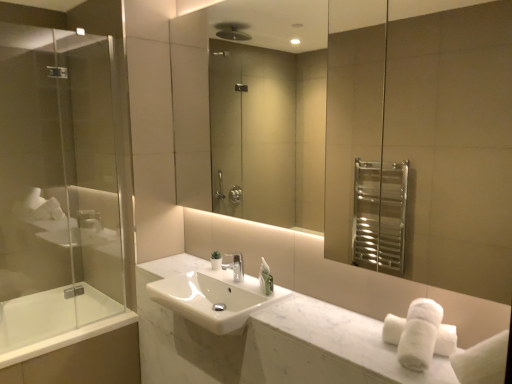
What is the approximate width of white marble counter at center?

13.60 inches.

The image size is (512, 384). What are the coordinates of `white marble counter at center` in the screenshot? It's located at (268, 342).

Measure the distance between white glossy sink at center and camera.

The depth of white glossy sink at center is 1.71 meters.

What do you see at coordinates (54, 322) in the screenshot? I see `white glossy bathtub at lower left` at bounding box center [54, 322].

Locate an element on the screen. The image size is (512, 384). white marble counter at center is located at coordinates (268, 342).

Considering the relative positions of transparent glass screen door at left and white marble counter at center in the image provided, is transparent glass screen door at left to the right of white marble counter at center from the viewer's perspective?

Incorrect, transparent glass screen door at left is not on the right side of white marble counter at center.

Image resolution: width=512 pixels, height=384 pixels. Identify the location of counter in front of the transparent glass screen door at left. (268, 342).

Based on their sizes in the image, would you say transparent glass screen door at left is bigger or smaller than white marble counter at center?

Considering their sizes, transparent glass screen door at left takes up more space than white marble counter at center.

How different are the orientations of transparent glass screen door at left and white marble counter at center in degrees?

The angle between the facing direction of transparent glass screen door at left and the facing direction of white marble counter at center is 90.8 degrees.

Is silver metallic faucet at center situated inside transparent glass screen door at left or outside?

silver metallic faucet at center lies outside transparent glass screen door at left.

Is silver metallic faucet at center touching transparent glass screen door at left?

No, silver metallic faucet at center is not in contact with transparent glass screen door at left.

Is silver metallic faucet at center turned away from transparent glass screen door at left?

No, silver metallic faucet at center is not facing the opposite direction of transparent glass screen door at left.

Is silver metallic faucet at center located within transparent glass screen door at left?

No, silver metallic faucet at center is located outside of transparent glass screen door at left.

How distant is transparent glass screen door at left from silver metallic faucet at center?

transparent glass screen door at left is 1.23 meters from silver metallic faucet at center.

Does point (51, 240) come in front of point (242, 262)?

No, (51, 240) is behind (242, 262).

From the image's perspective, which object appears higher, transparent glass screen door at left or silver metallic faucet at center?

transparent glass screen door at left is shown above in the image.

Is white glossy bathtub at lower left in front of or behind white glossy sink at center in the image?

In the image, white glossy bathtub at lower left appears behind white glossy sink at center.

From the image's perspective, is white glossy bathtub at lower left on top of white glossy sink at center?

No, from the image's perspective, white glossy bathtub at lower left is not above white glossy sink at center.

Does white glossy bathtub at lower left have a smaller size compared to white glossy sink at center?

No.

Could you tell me if white glossy bathtub at lower left is turned towards transparent glass screen door at left?

No, white glossy bathtub at lower left is not aimed at transparent glass screen door at left.

From a real-world perspective, which is physically above, white glossy bathtub at lower left or transparent glass screen door at left?

transparent glass screen door at left is physically above.

Is white glossy bathtub at lower left surrounding transparent glass screen door at left?

No, transparent glass screen door at left is not inside white glossy bathtub at lower left.

From the image's perspective, does white glossy bathtub at lower left appear lower than transparent glass screen door at left?

Yes, from the image's perspective, white glossy bathtub at lower left is below transparent glass screen door at left.

Considering the sizes of white glossy sink at center and silver metallic faucet at center in the image, is white glossy sink at center wider or thinner than silver metallic faucet at center?

In the image, white glossy sink at center appears to be wider than silver metallic faucet at center.

Is white glossy sink at center beside silver metallic faucet at center?

No, white glossy sink at center is not making contact with silver metallic faucet at center.

Between white glossy sink at center and silver metallic faucet at center, which one has larger size?

Bigger between the two is white glossy sink at center.

Could you tell me if white marble counter at center is facing transparent glass screen door at left?

No, white marble counter at center is not facing towards transparent glass screen door at left.

Considering the sizes of objects white marble counter at center and transparent glass screen door at left in the image provided, who is wider, white marble counter at center or transparent glass screen door at left?

Wider between the two is white marble counter at center.

In the scene shown: What's the angular difference between white marble counter at center and transparent glass screen door at left's facing directions?

The angular difference between white marble counter at center and transparent glass screen door at left is 90.8 degrees.

Where is `counter located below the transparent glass screen door at left (from the image's perspective)`? This screenshot has width=512, height=384. counter located below the transparent glass screen door at left (from the image's perspective) is located at coordinates click(x=268, y=342).

Locate an element on the screen. This screenshot has height=384, width=512. screen door that appears in front of the silver metallic faucet at center is located at coordinates (58, 163).

Considering their positions, is silver metallic faucet at center positioned closer to white glossy bathtub at lower left than white marble counter at center?

white marble counter at center is closer to white glossy bathtub at lower left.

Based on their spatial positions, is silver metallic faucet at center or white glossy bathtub at lower left further from white marble counter at center?

The object further to white marble counter at center is white glossy bathtub at lower left.

Estimate the real-world distances between objects in this image. Which object is further from white marble counter at center, white glossy bathtub at lower left or transparent glass screen door at left?

Among the two, transparent glass screen door at left is located further to white marble counter at center.

Based on their spatial positions, is transparent glass screen door at left or silver metallic faucet at center closer to white marble counter at center?

Among the two, silver metallic faucet at center is located nearer to white marble counter at center.

Looking at the image, which one is located closer to white glossy bathtub at lower left, white glossy sink at center or silver metallic faucet at center?

Based on the image, white glossy sink at center appears to be nearer to white glossy bathtub at lower left.

Looking at the image, which one is located closer to white marble counter at center, silver metallic faucet at center or transparent glass screen door at left?

silver metallic faucet at center.

Looking at this image, looking at the image, which one is located closer to white marble counter at center, white glossy sink at center or silver metallic faucet at center?

white glossy sink at center lies closer to white marble counter at center than the other object.

When comparing their distances from silver metallic faucet at center, does white marble counter at center or transparent glass screen door at left seem further?

Among the two, transparent glass screen door at left is located further to silver metallic faucet at center.

Locate an element on the screen. sink between white marble counter at center and silver metallic faucet at center from front to back is located at coordinates (207, 293).

You are a GUI agent. You are given a task and a screenshot of the screen. Output one action in this format:
    pyautogui.click(x=<x>, y=<y>)
    Task: Click on the sink between white glossy bathtub at lower left and white marble counter at center in the horizontal direction
    Image resolution: width=512 pixels, height=384 pixels.
    Given the screenshot: What is the action you would take?
    pyautogui.click(x=207, y=293)

This screenshot has width=512, height=384. I want to click on screen door situated between white glossy bathtub at lower left and white glossy sink at center from left to right, so click(58, 163).

Where is `tap between transparent glass screen door at left and white marble counter at center`? tap between transparent glass screen door at left and white marble counter at center is located at coordinates (236, 267).